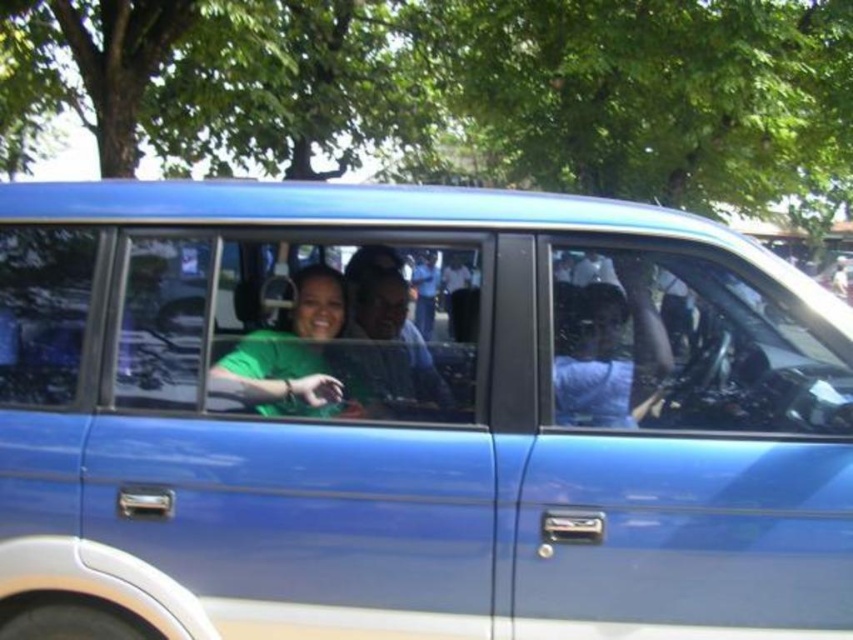
You are standing on the sidewalk next to the blue minivan. You want to place a 2.5 feet wide flower pot on the ground so that it is exactly at the point labeled as point (810,408). Can you reach that point from your current position without moving your feet?

The point (810,408) is 7.09 feet away from the viewer. Since the flower pot is 2.5 feet wide, you need to ensure the distance from your position allows placing it accurately. However, 7.09 feet is beyond typical arm reach, so you cannot place the flower pot at point (810,408) without moving your feet.

You are a passenger in the blue minivan and want to locate the transparent glass steering wheel at center. Based on the coordinates provided, where should you look relative to your position?

The transparent glass steering wheel at center is located at point coordinates 0.541 on the x axis and 0.808 on the y axis. Since the coordinate system typically places the origin at the bottom left corner, you should look towards the center area of the vehicle, slightly towards the front and middle section.

You are a delivery person trying to locate a blue metallic minivan at center for a package delivery. The GPS shows a point at coordinates (412, 419). Based on the scene description, where should you look to find the blue metallic minivan at center?

The point at coordinates (412, 419) corresponds to the blue metallic minivan at center, so you should look towards the center of the image to find it.